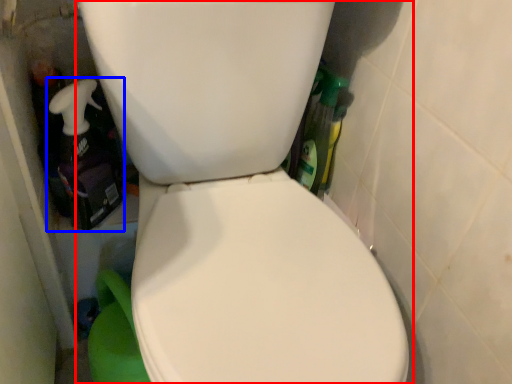
Question: Which point is further to the camera, toilet (highlighted by a red box) or cleaning product (highlighted by a blue box)?

Choices:
 (A) toilet
 (B) cleaning product

Answer: (B)